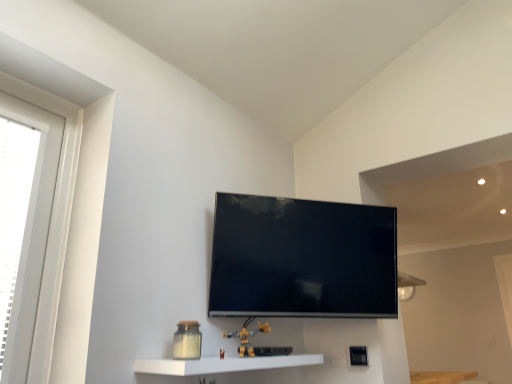
Locate an element on the screen. This screenshot has height=384, width=512. flat screen tv at center is located at coordinates (302, 259).

What do you see at coordinates (302, 259) in the screenshot? I see `flat screen tv at center` at bounding box center [302, 259].

Describe the element at coordinates (31, 232) in the screenshot. Image resolution: width=512 pixels, height=384 pixels. I see `white plastic window at left` at that location.

Identify the location of yellow plastic toy at lower center. The width and height of the screenshot is (512, 384). (247, 337).

Can you confirm if flat screen tv at center is shorter than white plastic window at left?

Yes, flat screen tv at center is shorter than white plastic window at left.

Is flat screen tv at center in contact with white plastic window at left?

No, flat screen tv at center is not with white plastic window at left.

Do you think flat screen tv at center is within white plastic window at left, or outside of it?

flat screen tv at center cannot be found inside white plastic window at left.

Which of these two, flat screen tv at center or white plastic window at left, is smaller?

Smaller between the two is white plastic window at left.

From the image's perspective, which one is positioned lower, white plastic window at left or yellow plastic toy at lower center?

From the image's view, yellow plastic toy at lower center is below.

In the scene shown: How many degrees apart are the facing directions of white plastic window at left and yellow plastic toy at lower center?

The angle between the facing direction of white plastic window at left and the facing direction of yellow plastic toy at lower center is 1.78 degrees.

Between white plastic window at left and yellow plastic toy at lower center, which one has smaller width?

white plastic window at left.

Which of these two, yellow plastic toy at lower center or white plastic window at left, is smaller?

yellow plastic toy at lower center is smaller.

Where is `toy below the white plastic window at left (from a real-world perspective)`? The width and height of the screenshot is (512, 384). toy below the white plastic window at left (from a real-world perspective) is located at coordinates (247, 337).

Are yellow plastic toy at lower center and white plastic window at left far apart?

No.

Relative to white plastic window at left, is yellow plastic toy at lower center in front or behind?

yellow plastic toy at lower center is behind white plastic window at left.

Could yellow plastic toy at lower center be considered to be inside white glossy shelf at lower center?

No, yellow plastic toy at lower center is not surrounded by white glossy shelf at lower center.

From the picture: How different are the orientations of white glossy shelf at lower center and yellow plastic toy at lower center in degrees?

white glossy shelf at lower center and yellow plastic toy at lower center are facing 2.97 degrees away from each other.

Does white glossy shelf at lower center have a larger size compared to yellow plastic toy at lower center?

Yes.

Which of these two, white glossy shelf at lower center or yellow plastic toy at lower center, stands taller?

With more height is yellow plastic toy at lower center.

Could you tell me if white glossy shelf at lower center is facing white plastic window at left?

No, white glossy shelf at lower center is not turned towards white plastic window at left.

Relative to white plastic window at left, is white glossy shelf at lower center in front or behind?

white glossy shelf at lower center is behind white plastic window at left.

Considering the sizes of objects white glossy shelf at lower center and white plastic window at left in the image provided, who is shorter, white glossy shelf at lower center or white plastic window at left?

Standing shorter between the two is white glossy shelf at lower center.

Who is bigger, white glossy shelf at lower center or white plastic window at left?

white plastic window at left is bigger.

Considering the relative sizes of white glossy shelf at lower center and flat screen tv at center in the image provided, is white glossy shelf at lower center shorter than flat screen tv at center?

Correct, white glossy shelf at lower center is not as tall as flat screen tv at center.

Is white glossy shelf at lower center wider than flat screen tv at center?

Correct, the width of white glossy shelf at lower center exceeds that of flat screen tv at center.

Locate an element on the screen. television above the white glossy shelf at lower center (from a real-world perspective) is located at coordinates (302, 259).

Is white glossy shelf at lower center aimed at flat screen tv at center?

No, white glossy shelf at lower center is not oriented towards flat screen tv at center.

Could you tell me if white plastic window at left is turned towards flat screen tv at center?

No, white plastic window at left is not aimed at flat screen tv at center.

You are a GUI agent. You are given a task and a screenshot of the screen. Output one action in this format:
    pyautogui.click(x=<x>, y=<y>)
    Task: Click on the window located above the flat screen tv at center (from a real-world perspective)
    This screenshot has height=384, width=512.
    Given the screenshot: What is the action you would take?
    pyautogui.click(x=31, y=232)

Who is bigger, white plastic window at left or flat screen tv at center?

Bigger between the two is flat screen tv at center.

Is white plastic window at left completely or partially outside of flat screen tv at center?

Yes.

Image resolution: width=512 pixels, height=384 pixels. In the image, there is a white plastic window at left. In order to click on television below it (from a real-world perspective) in this screenshot , I will do `click(302, 259)`.

Locate an element on the screen. The width and height of the screenshot is (512, 384). window on the left of yellow plastic toy at lower center is located at coordinates (31, 232).

Looking at the image, which one is located closer to yellow plastic toy at lower center, white glossy shelf at lower center or white plastic window at left?

white glossy shelf at lower center.

Looking at the image, which one is located further to yellow plastic toy at lower center, white glossy shelf at lower center or flat screen tv at center?

flat screen tv at center lies further to yellow plastic toy at lower center than the other object.

From the image, which object appears to be nearer to flat screen tv at center, white plastic window at left or white glossy shelf at lower center?

white glossy shelf at lower center lies closer to flat screen tv at center than the other object.

Estimate the real-world distances between objects in this image. Which object is further from white plastic window at left, flat screen tv at center or white glossy shelf at lower center?

flat screen tv at center.

When comparing their distances from yellow plastic toy at lower center, does white plastic window at left or white glossy shelf at lower center seem closer?

Among the two, white glossy shelf at lower center is located nearer to yellow plastic toy at lower center.

From the image, which object appears to be farther from flat screen tv at center, white glossy shelf at lower center or white plastic window at left?

white plastic window at left.

When comparing their distances from white glossy shelf at lower center, does yellow plastic toy at lower center or flat screen tv at center seem closer?

yellow plastic toy at lower center is positioned closer to the anchor white glossy shelf at lower center.

From the picture: From the image, which object appears to be nearer to white plastic window at left, white glossy shelf at lower center or flat screen tv at center?

Based on the image, white glossy shelf at lower center appears to be nearer to white plastic window at left.

The width and height of the screenshot is (512, 384). Find the location of `shelf located between white plastic window at left and yellow plastic toy at lower center in the left-right direction`. shelf located between white plastic window at left and yellow plastic toy at lower center in the left-right direction is located at coordinates (223, 364).

Find the location of a particular element. toy between flat screen tv at center and white glossy shelf at lower center in the vertical direction is located at coordinates (247, 337).

Locate an element on the screen. The height and width of the screenshot is (384, 512). shelf located between white plastic window at left and flat screen tv at center in the left-right direction is located at coordinates (223, 364).

This screenshot has width=512, height=384. In order to click on toy between white plastic window at left and flat screen tv at center in the horizontal direction in this screenshot , I will do `click(247, 337)`.